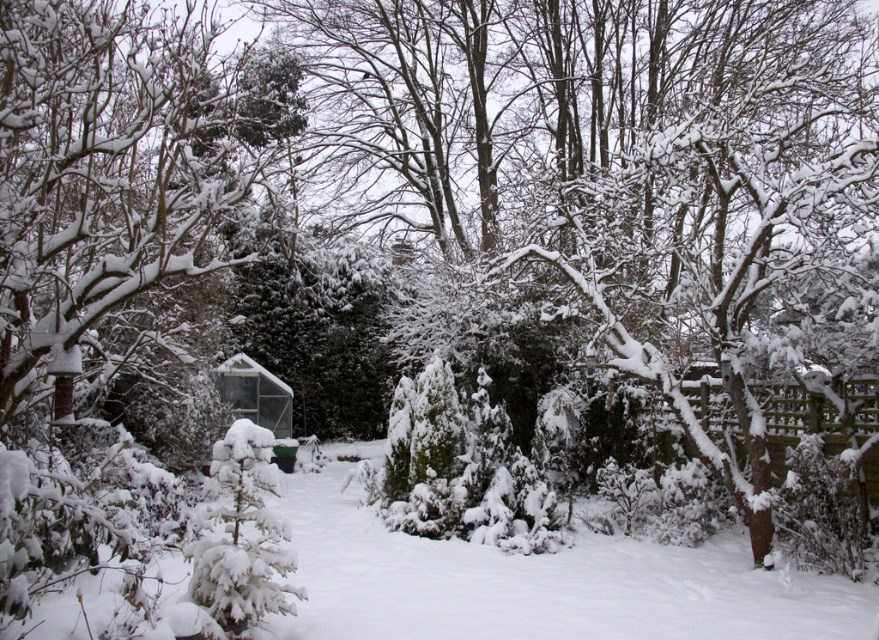
Can you confirm if snow-covered evergreen tree at left is positioned to the left of transparent plastic hut at center?

No, snow-covered evergreen tree at left is not to the left of transparent plastic hut at center.

In the scene shown: Does snow-covered evergreen tree at left have a larger size compared to transparent plastic hut at center?

Indeed, snow-covered evergreen tree at left has a larger size compared to transparent plastic hut at center.

Does point (169, 205) lie in front of point (267, 388)?

That is True.

You are a GUI agent. You are given a task and a screenshot of the screen. Output one action in this format:
    pyautogui.click(x=<x>, y=<y>)
    Task: Click on the snow-covered evergreen tree at left
    The width and height of the screenshot is (879, 640).
    Given the screenshot: What is the action you would take?
    pyautogui.click(x=99, y=232)